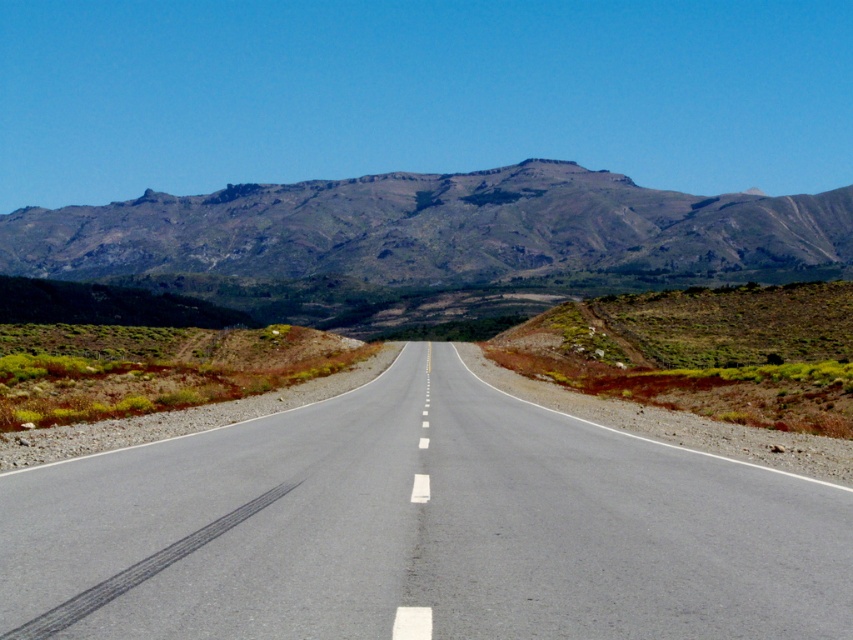
Who is lower down, asphalt road at center or gray rocky mountain range at upper center?

Positioned lower is asphalt road at center.

Is asphalt road at center bigger than gray rocky mountain range at upper center?

Incorrect, asphalt road at center is not larger than gray rocky mountain range at upper center.

Between point (56, 564) and point (546, 204), which one is positioned in front?

Point (56, 564) is in front.

Identify the location of asphalt road at center. (422, 529).